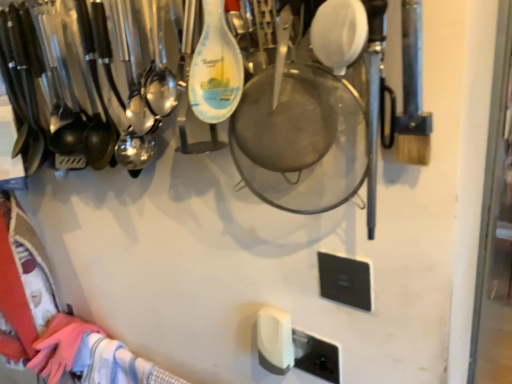
Question: In terms of size, does white plastic light switch at lower center, the first light switch in the left-to-right sequence, appear bigger or smaller than black plastic light switch at lower right, the 2th light switch in the back-to-front sequence?

Choices:
 (A) big
 (B) small

Answer: (A)

Question: Do you think white plastic light switch at lower center, which appears as the second light switch when viewed from the top, is within black plastic light switch at lower right, the 2th light switch in the back-to-front sequence, or outside of it?

Choices:
 (A) outside
 (B) inside

Answer: (A)

Question: Is white plastic light switch at lower center, which appears as the second light switch when viewed from the top, in front of or behind black plastic light switch at lower right, the 1th light switch when ordered from right to left, in the image?

Choices:
 (A) front
 (B) behind

Answer: (B)

Question: Looking at the image, does black plastic light switch at lower right, the 2th light switch in the back-to-front sequence, seem bigger or smaller compared to white plastic light switch at lower center, which appears as the second light switch when viewed from the top?

Choices:
 (A) small
 (B) big

Answer: (A)

Question: From a real-world perspective, is black plastic light switch at lower right, the first light switch when ordered from top to bottom, physically located above or below white plastic light switch at lower center, the 1th light switch in the back-to-front sequence?

Choices:
 (A) above
 (B) below

Answer: (A)

Question: Considering the positions of black plastic light switch at lower right, the second light switch viewed from the left, and white plastic light switch at lower center, the 1th light switch in the back-to-front sequence, in the image, is black plastic light switch at lower right, the second light switch viewed from the left, taller or shorter than white plastic light switch at lower center, the 1th light switch in the back-to-front sequence,?

Choices:
 (A) short
 (B) tall

Answer: (A)

Question: Is black plastic light switch at lower right, the 2th light switch in the back-to-front sequence, inside or outside of white plastic light switch at lower center, the 1th light switch in the back-to-front sequence?

Choices:
 (A) inside
 (B) outside

Answer: (B)